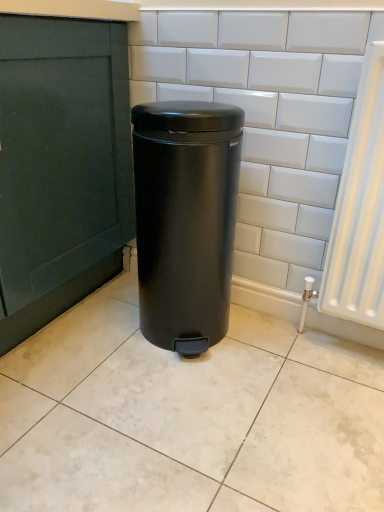
Image resolution: width=384 pixels, height=512 pixels. What are the coordinates of `vacant region to the right of matte black trash can at center` in the screenshot? It's located at (281, 347).